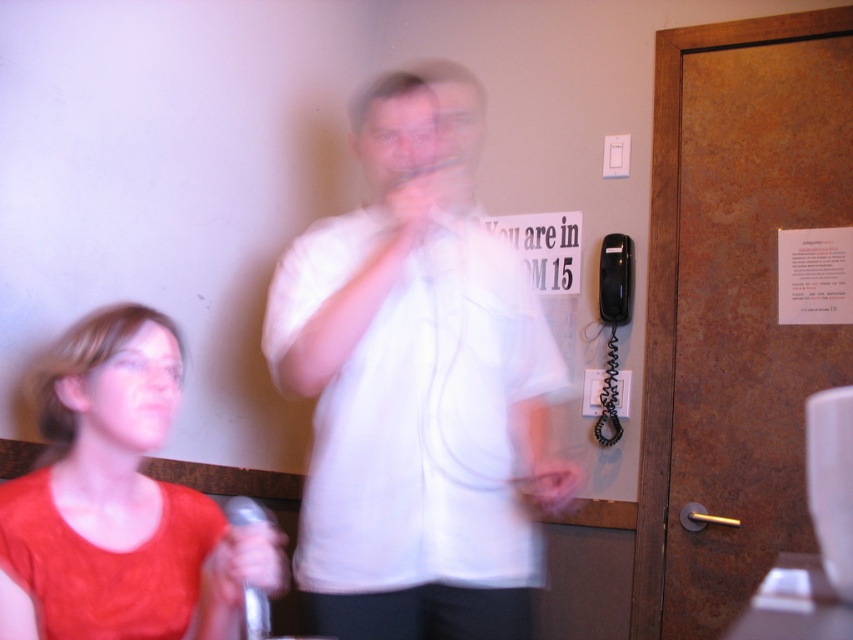
You are attending a virtual meeting and notice two participants on your screen. One is wearing a white matte shirt at center and the other a matte red shirt at left. Based on their clothing sizes, which participant is likely closer to the camera?

The white matte shirt at center is larger in size than the matte red shirt at left, so the participant wearing the white matte shirt at center is likely closer to the camera because objects closer to the camera appear larger.

You are organizing a photo shoot and need to arrange two models wearing the white matte shirt at center and the matte red shirt at left. Based on the scene description, which model should stand closer to the camera to ensure both appear equally wide in the photo?

The white matte shirt at center might be wider than the matte red shirt at left, so the model wearing the white matte shirt at center should stand farther from the camera, while the one in the matte red shirt at left should be closer. This way, their apparent widths in the photo will balance out.